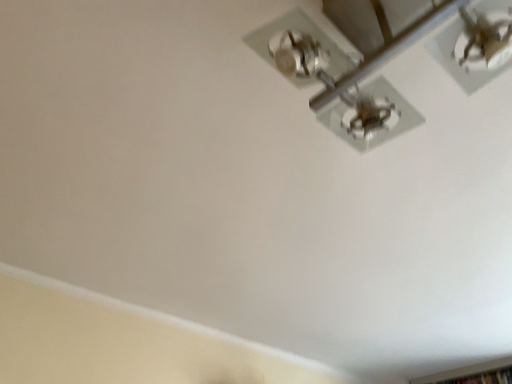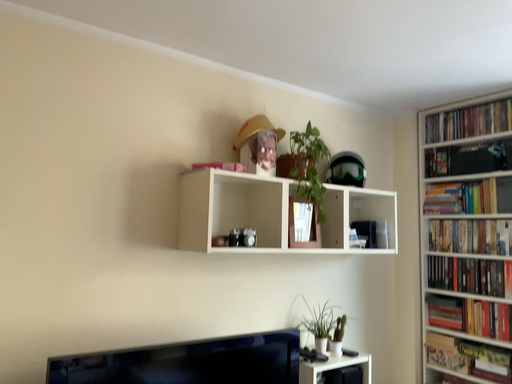
Question: How did the camera likely rotate when shooting the video?

Choices:
 (A) rotated downward
 (B) rotated upward

Answer: (A)